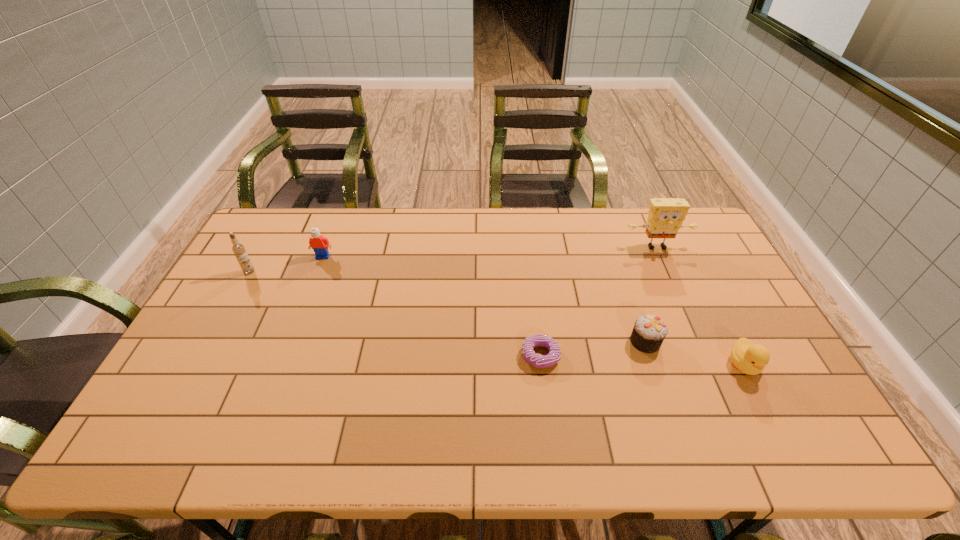
Where is `free region at the far edge of the desktop`? The image size is (960, 540). free region at the far edge of the desktop is located at coordinates (524, 238).

What are the coordinates of `vacant space at the near edge of the desktop` in the screenshot? It's located at (235, 449).

In the image, there is a desktop. In order to click on vacant area at the left edge in this screenshot , I will do `click(283, 261)`.

In the image, there is a desktop. At what (x,y) coordinates should I click in order to perform the action: click on vacant space at the right edge. Please return your answer as a coordinate pair (x, y). The width and height of the screenshot is (960, 540). Looking at the image, I should click on (764, 375).

Identify the location of free space at the far left corner of the desktop. The height and width of the screenshot is (540, 960). (288, 210).

The width and height of the screenshot is (960, 540). I want to click on free space at the far right corner, so click(x=706, y=243).

Locate an element on the screen. free space at the near right corner of the desktop is located at coordinates (816, 457).

Where is `vacant area that lies between the duck and the cupcake`? The width and height of the screenshot is (960, 540). vacant area that lies between the duck and the cupcake is located at coordinates (694, 353).

The width and height of the screenshot is (960, 540). I want to click on free space between the sponge and the duck, so click(700, 306).

The image size is (960, 540). I want to click on vacant region between the vodka and the sponge, so click(x=453, y=259).